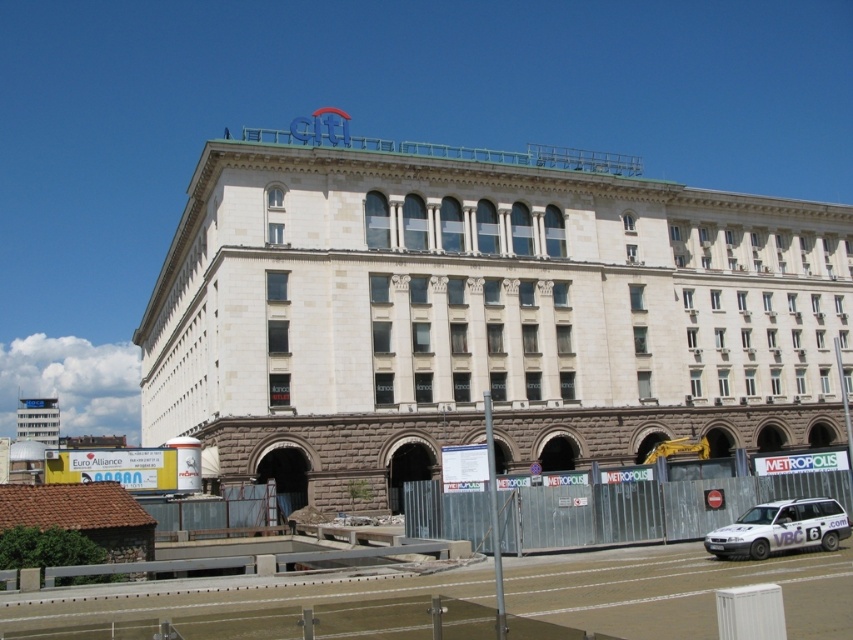
You are a delivery driver approaching the white stone building at upper center and the white matte van at lower right. Which object will appear bigger in your view as you drive closer to the building?

The white stone building at upper center will appear bigger in your view as you drive closer because it is larger in size than the white matte van at lower right.

You are a delivery driver in a white matte van at lower right and need to reach the white stone building at upper center. The road is closed except for a path that allows vehicles up to 70 meters in length. Can your van safely navigate to the building?

The distance between the white stone building at upper center and the white matte van at lower right is 71.08 meters. Since the path allows vehicles up to 70 meters, the van cannot safely navigate to the building due to exceeding the maximum allowed length.